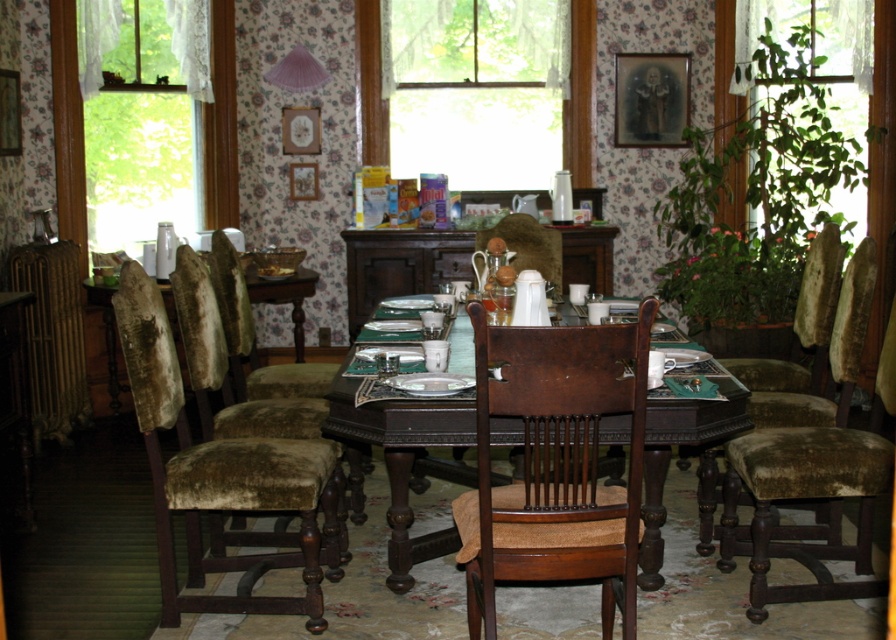
You are a guest entering the dining room and see the velvet green armchair at left and the velvet green table at left. Which one takes up more space in the room?

The velvet green armchair at left is larger in size than the velvet green table at left, so it takes up more space in the room.

You are sitting in the dining room and want to move from your current position to the window to adjust the curtain. You see the velvet green armchair at left and the velvet green table at left. Which object is closer to you?

The velvet green armchair at left is closer to you because it is in front of the velvet green table at left.